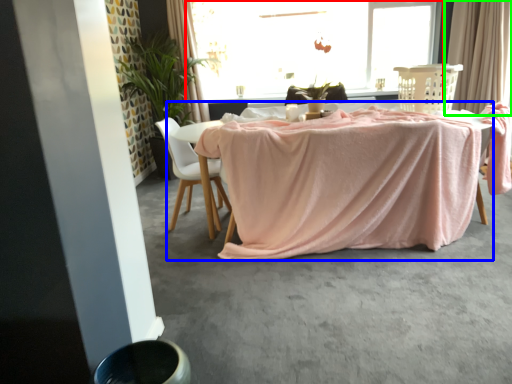
Question: Considering the real-world distances, which object is farthest from window (highlighted by a red box)? table (highlighted by a blue box) or curtain (highlighted by a green box)?

Choices:
 (A) table
 (B) curtain

Answer: (A)